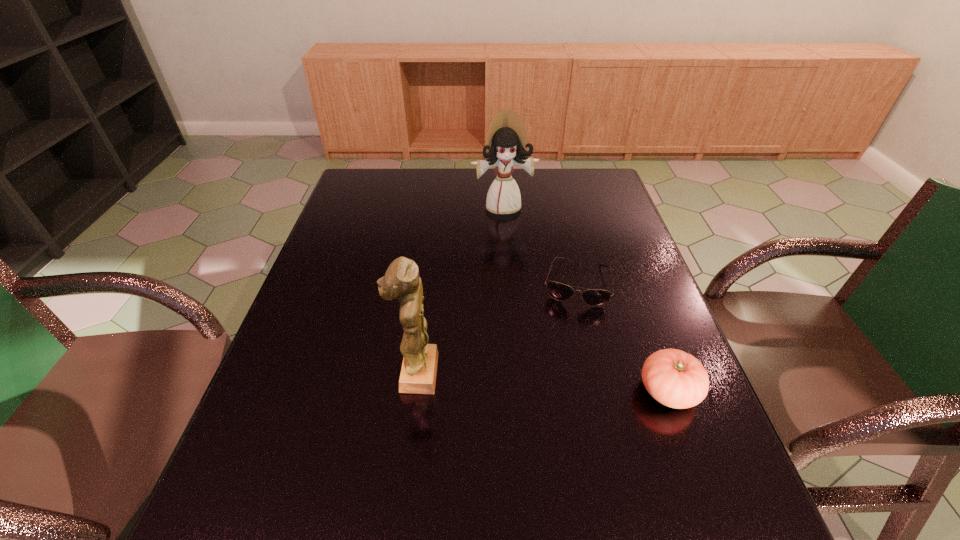
At what (x,y) coordinates should I click in order to perform the action: click on free space located 0.200m at the front face of the doll. Please return your answer as a coordinate pair (x, y). Image resolution: width=960 pixels, height=540 pixels. Looking at the image, I should click on (517, 259).

At what (x,y) coordinates should I click in order to perform the action: click on free point located 0.250m at the front face of the doll. Please return your answer as a coordinate pair (x, y). The height and width of the screenshot is (540, 960). Looking at the image, I should click on (520, 270).

The width and height of the screenshot is (960, 540). Find the location of `free location located 0.200m on the front-facing side of the shortest object`. free location located 0.200m on the front-facing side of the shortest object is located at coordinates (563, 372).

The height and width of the screenshot is (540, 960). I want to click on vacant space located on the front-facing side of the shortest object, so click(557, 408).

At what (x,y) coordinates should I click in order to perform the action: click on vacant region located on the front-facing side of the shortest object. Please return your answer as a coordinate pair (x, y). This screenshot has height=540, width=960. Looking at the image, I should click on (561, 383).

The height and width of the screenshot is (540, 960). Find the location of `object that is at the far edge`. object that is at the far edge is located at coordinates (508, 144).

Locate an element on the screen. tomato that is at the right edge is located at coordinates coord(676,379).

This screenshot has height=540, width=960. Identify the location of sunglasses that is positioned at the right edge. (593, 297).

This screenshot has width=960, height=540. In order to click on free region at the far edge in this screenshot , I will do `click(402, 167)`.

In the image, there is a desktop. Identify the location of vacant space at the left edge. This screenshot has width=960, height=540. (318, 382).